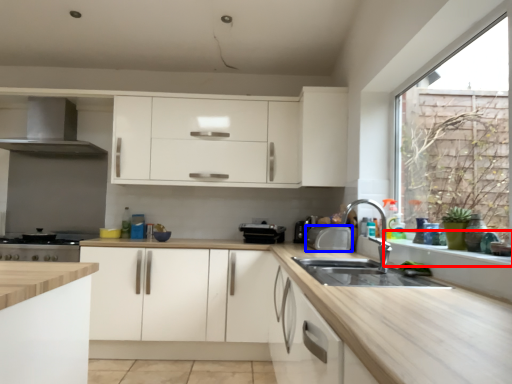
Question: Among these objects, which one is farthest to the camera, window sill (highlighted by a red box) or appliance (highlighted by a blue box)?

Choices:
 (A) window sill
 (B) appliance

Answer: (B)